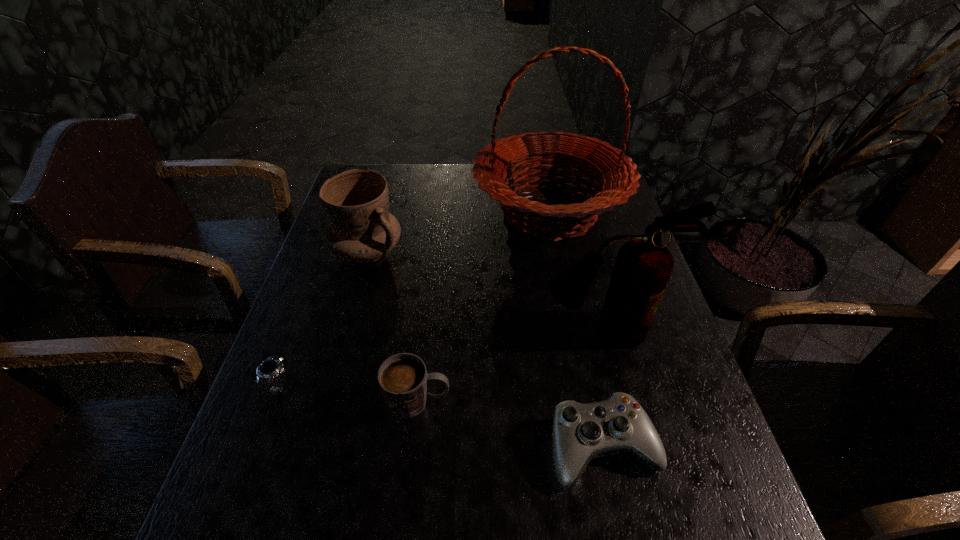
Where is `vacant area that satisfies the following two spatial constraints: 1. at the nozzle of the fire extinguisher; 2. on the side of the mug with the handle`? vacant area that satisfies the following two spatial constraints: 1. at the nozzle of the fire extinguisher; 2. on the side of the mug with the handle is located at coordinates (623, 401).

Image resolution: width=960 pixels, height=540 pixels. I want to click on free spot that satisfies the following two spatial constraints: 1. on the back side of the basket; 2. on the right side of the pottery, so click(378, 212).

Identify the location of vacant space that satisfies the following two spatial constraints: 1. on the back side of the control; 2. on the side of the fourth tallest object with the handle. The image size is (960, 540). point(593,401).